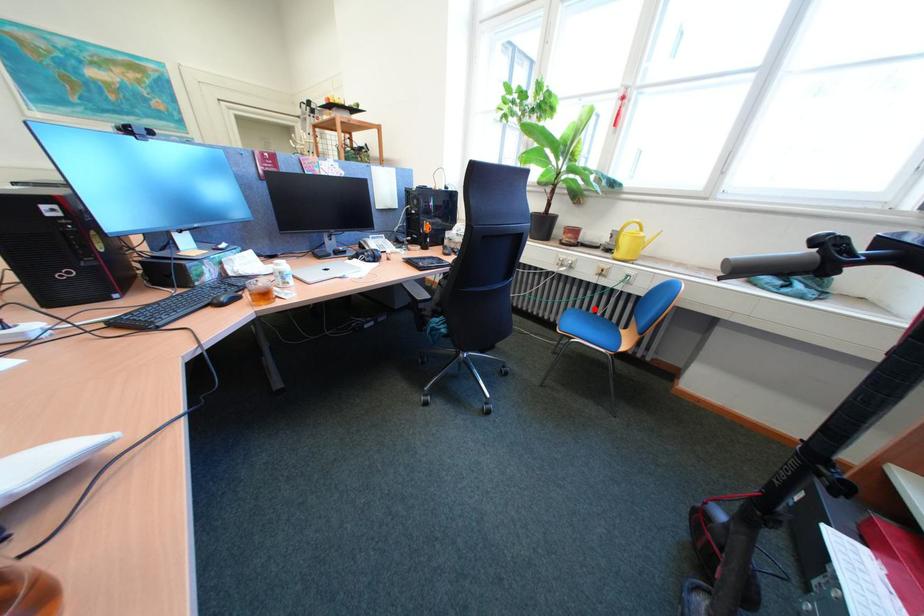
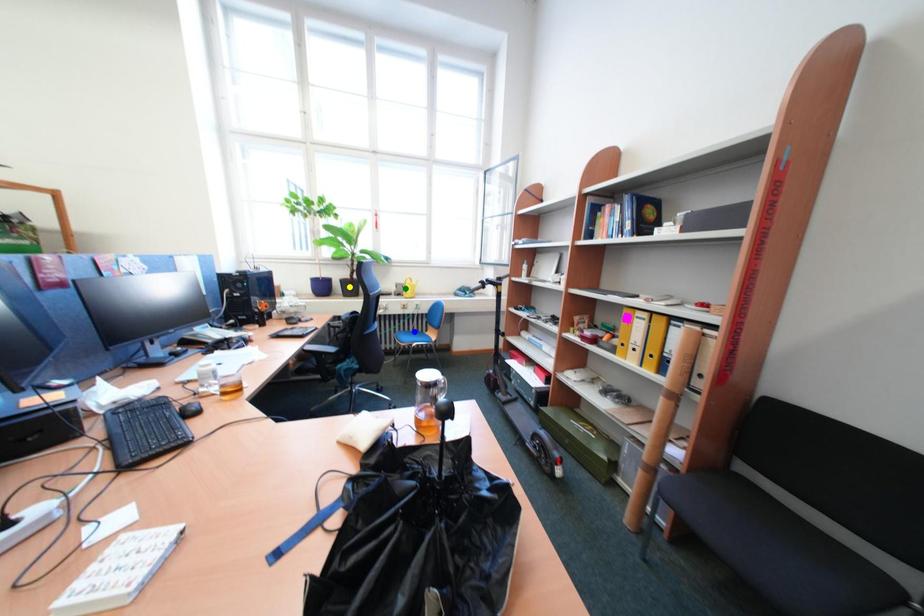
Question: I am providing you with two images of the same scene from different viewpoints. A red point is marked on the first image. You are given multiple points on the second image. Which mark in image 2 goes with the point in image 1?

Choices:
 (A) yellow point
 (B) green point
 (C) blue point

Answer: (C)